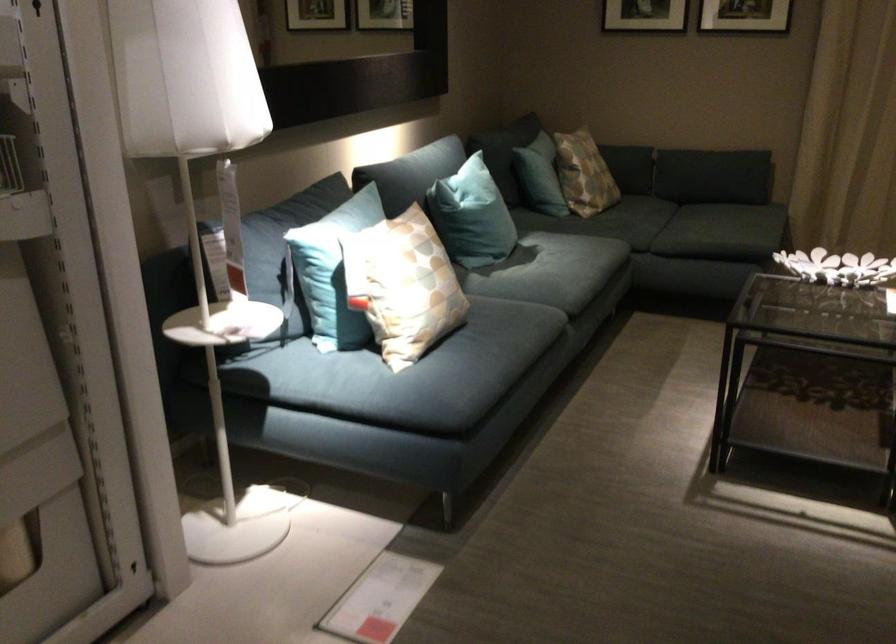
Find where to sit the sofa sitting surface. Please return your answer as a coordinate pair (x, y).

(552, 275)